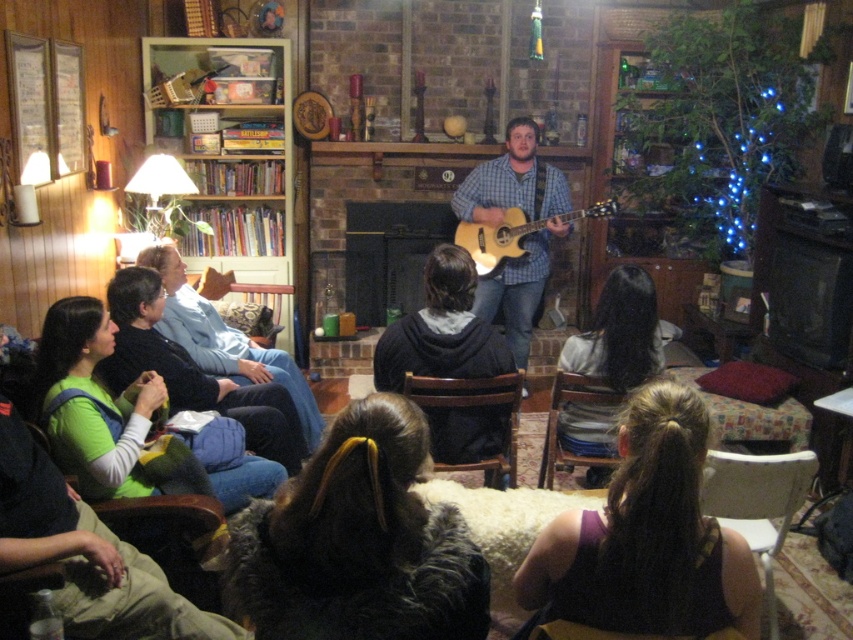
You are a photographer setting up a camera in this scene. You want to capture both the dark brown fur at center and the wooden bookshelf at upper left in the same frame. Which object should you focus on first to ensure both are in the frame without moving the camera?

The dark brown fur at center has a lesser width compared to wooden bookshelf at upper left, so you should focus on the wider wooden bookshelf at upper left first to ensure both fit in the frame.

You are standing in the audience and want to take a photo of the performer. You notice two points in the scene labeled as point [450,630] and point [404,385]. Which of these points is closer to your camera lens?

Point [450,630] is closer to the camera than point [404,385], so the photo will capture it more prominently.

You are a photographer setting up for a live music event. You need to position a camera so it can capture both the light brown wood guitar at center and the acoustic wood guitar at center clearly. Based on their positions, which guitar should you place on the left side of the camera frame?

The light brown wood guitar at center is to the left of the acoustic wood guitar at center, so you should place the light brown wood guitar at center on the left side of the camera frame to capture both guitars clearly.